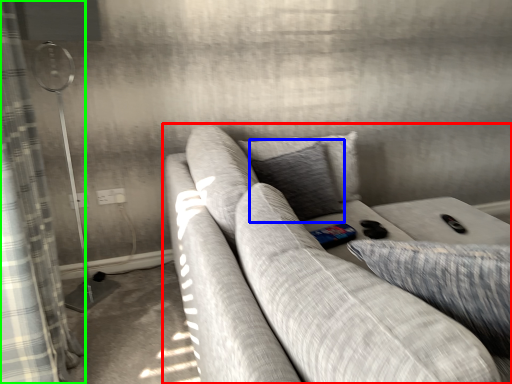
Question: Which is farther away from studio couch (highlighted by a red box)? pillow (highlighted by a blue box) or curtain (highlighted by a green box)?

Choices:
 (A) pillow
 (B) curtain

Answer: (B)